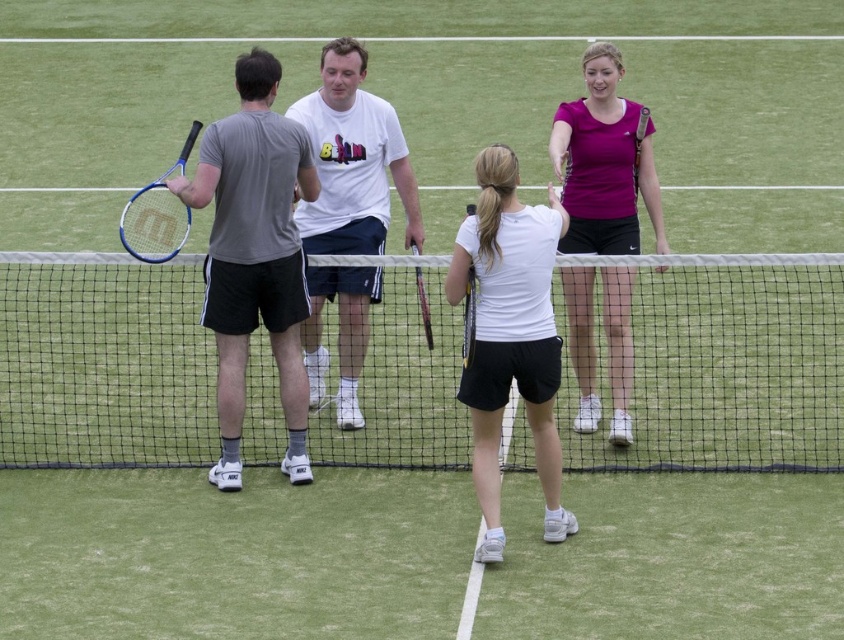
You are a tennis coach observing a match and need to quickly assess the players. Which tennis racket is positioned lower on the court between the purple matte tennis racket at upper right and the blue matte tennis racket at left?

The purple matte tennis racket at upper right is located below the blue matte tennis racket at left, so the purple one is positioned lower.

You are a tennis player standing on the court and want to hit a ball over the white mesh net at center. Your racket, the black matte tennis racket at center, is positioned above the net. Can you successfully hit the ball over the net without it touching the net?

The white mesh net at center is below the black matte tennis racket at center, so the racket is positioned above the net. This means you can successfully hit the ball over the net without it touching the net as the racket is already above the net.

You are a tennis ball that just bounced near the center of the court. You want to roll towards the nearest racket between the purple matte tennis racket at upper right and the blue matte tennis racket at left. Which racket should you roll towards?

The blue matte tennis racket at left is closer because it is only 9.15 feet away from the purple matte tennis racket at upper right. Since you are at the center, the blue one is nearer.